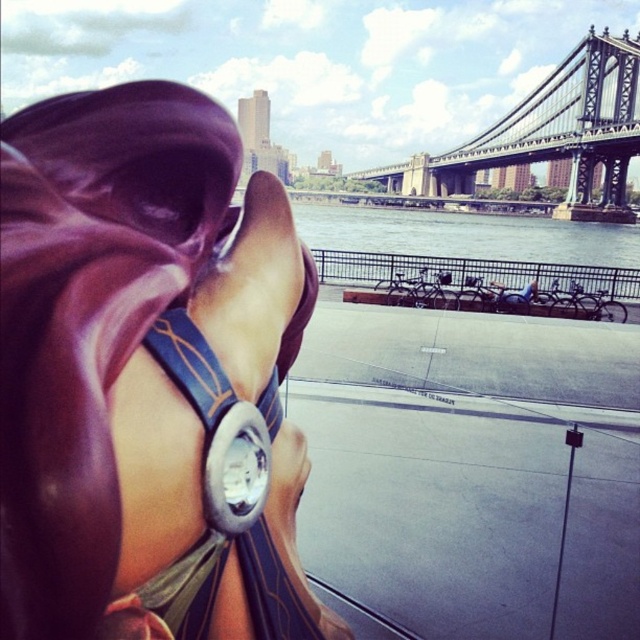
Question: Which point appears farthest from the camera in this image?

Choices:
 (A) (74, 419)
 (B) (532, 118)
 (C) (460, 236)
 (D) (278, 634)

Answer: (B)

Question: Which object is the farthest from the gray water at center?

Choices:
 (A) black metal bridge at upper right
 (B) leather/embossed belt at center
 (C) leather-like bikini top at center

Answer: (B)

Question: Does gray water at center appear on the left side of black metal bridge at upper right?

Choices:
 (A) no
 (B) yes

Answer: (B)

Question: Which object is positioned closest to the leather-like bikini top at center?

Choices:
 (A) black metal bridge at upper right
 (B) gray water at center
 (C) leather/embossed belt at center

Answer: (C)

Question: Does leather-like bikini top at center come in front of gray water at center?

Choices:
 (A) no
 (B) yes

Answer: (B)

Question: Is leather-like bikini top at center bigger than leather/embossed belt at center?

Choices:
 (A) no
 (B) yes

Answer: (B)